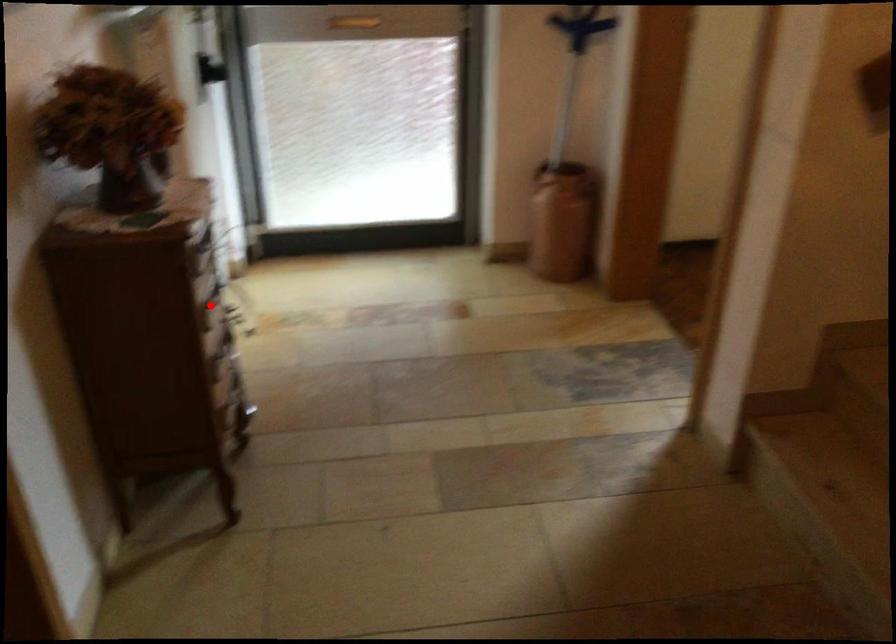
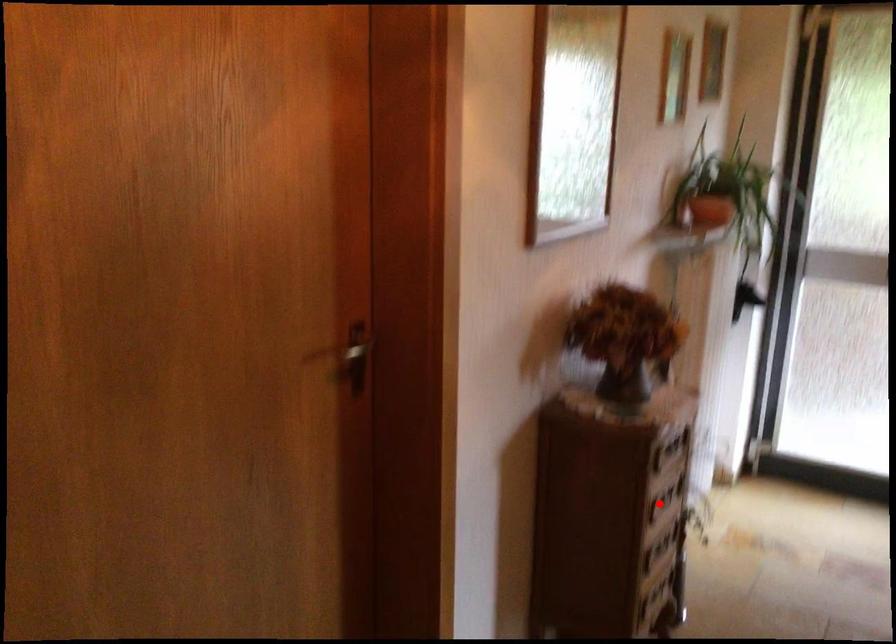
I am providing you with two images of the same scene from different viewpoints. A red point is marked on the first image and another point is marked on the second image. Does the point marked in image1 correspond to the same location as the one in image2?

Yes